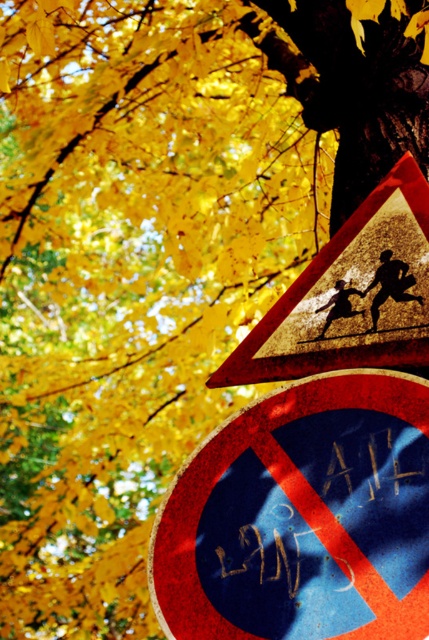
You are a pedestrian standing at the edge of the road where the rusty metal sign at lower center and the metallic reflective triangle at upper center are visible. Which of these two signs is shorter in height?

The rusty metal sign at lower center has a lesser height compared to the metallic reflective triangle at upper center, so the rusty metal sign at lower center is shorter.

You are a delivery robot with a 30 inch wide package. You need to navigate between the dark blue paper at center and the metallic reflective triangle at upper center. Can your package fit through the space between them?

The distance between the dark blue paper at center and the metallic reflective triangle at upper center is 30.74 inches. Since your package is 30 inches wide, there is enough space for it to pass through.